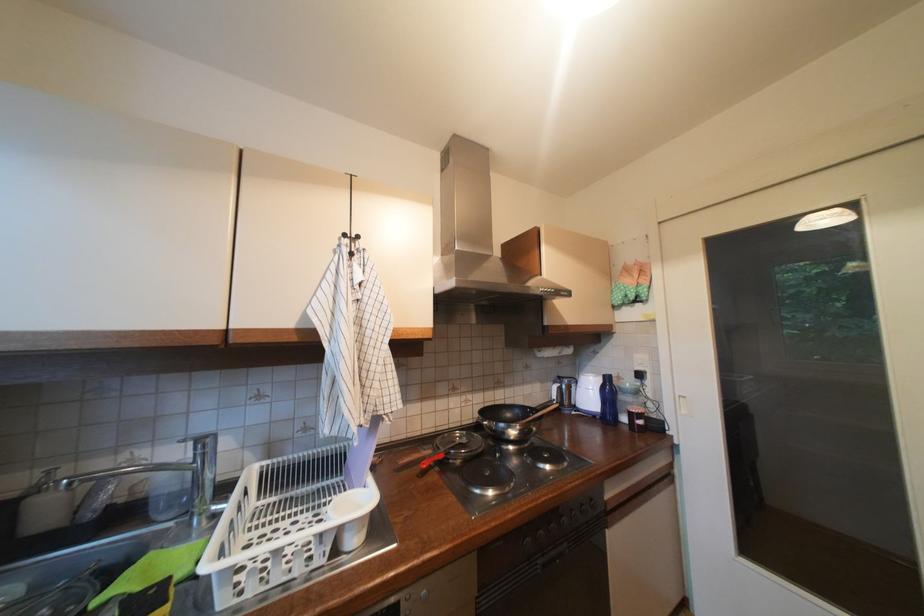
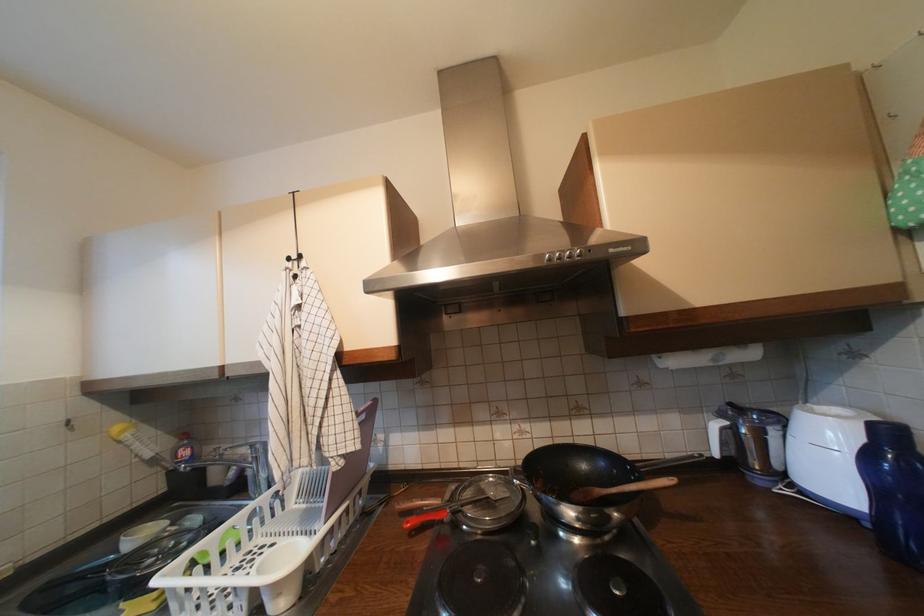
In the second image, find the point that corresponds to [432,464] in the first image.

(417, 524)